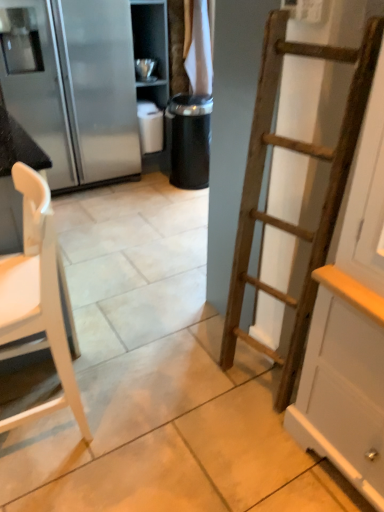
The image size is (384, 512). What do you see at coordinates (36, 298) in the screenshot?
I see `white matte chair at left` at bounding box center [36, 298].

This screenshot has width=384, height=512. Find the location of `white matte chair at left`. white matte chair at left is located at coordinates (36, 298).

Image resolution: width=384 pixels, height=512 pixels. What are the coordinates of `white matte chair at left` in the screenshot? It's located at (36, 298).